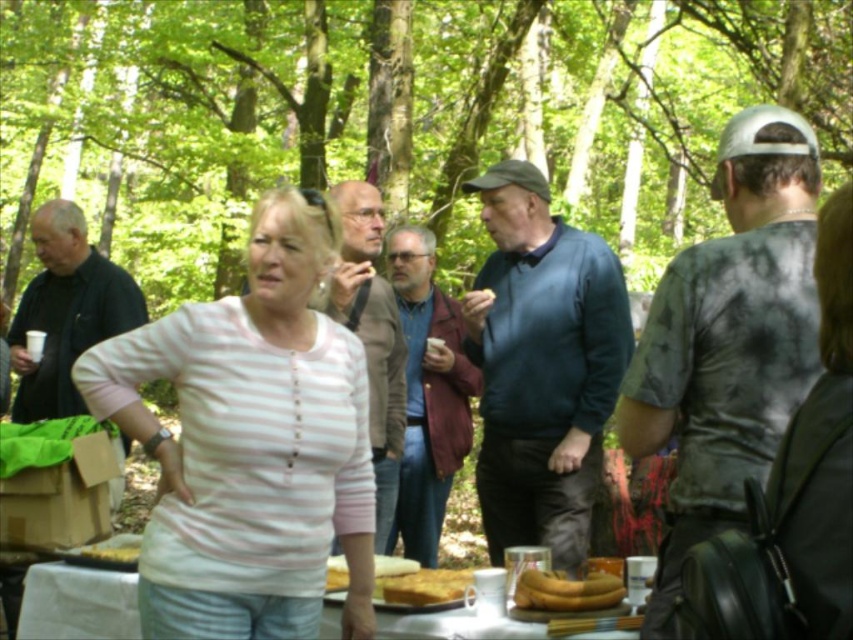
Consider the image. You are a photographer setting up a shot of the white glossy table at lower center and the golden brown cake at center. Which object should you focus on first to ensure both are in sharp focus?

The white glossy table at lower center is further to the viewer than the golden brown cake at center, so you should focus on the white glossy table at lower center first to ensure both are in sharp focus.

In the scene shown: You are a baker who needs to place a decorative ribbon between the golden brown cake at center and the smooth white bread at lower center. The ribbon is 6 inches long. Will it be long enough to stretch between them?

The distance between the golden brown cake at center and the smooth white bread at lower center is 6.72 inches. Since the ribbon is only 6 inches long, it will be too short to stretch between them.

Based on the photo, you are a guest at a picnic in the forest and see the white glossy table at lower center and the golden brown cake at center. Which object is positioned to the left of the other?

The white glossy table at lower center is positioned to the left of the golden brown cake at center.